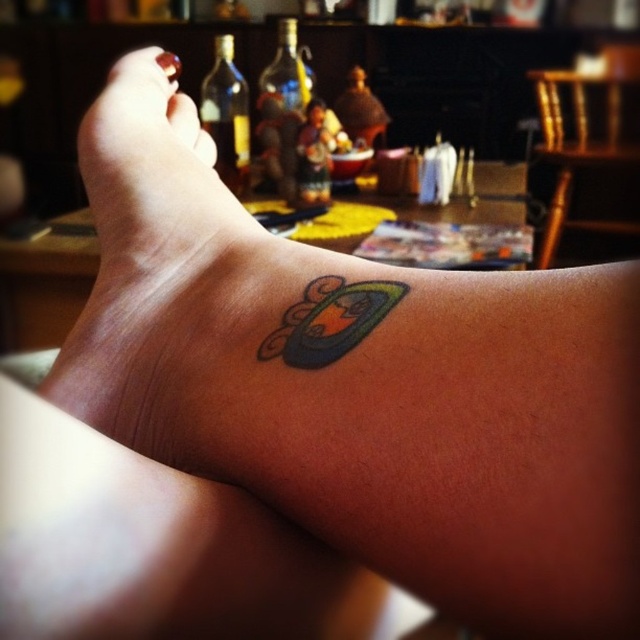
What are the coordinates of the multicolored glossy tattoo at lower center?

The multicolored glossy tattoo at lower center is located at point (330, 321).

You are holding a small flashlight that emits a beam 8 inches in diameter. You want to shine it directly on the point at coordinates point (342, 355) in the image. Considering the distance from your eye to the point, will the entire beam cover the point without spilling over to other areas?

The point at coordinates point (342, 355) is 7.55 inches away from the viewer. Since the flashlight beam is 8 inches in diameter, which is slightly larger than the distance, the beam will cover the point but may spill over slightly to adjacent areas.

Looking at this image, you are a photographer setting up a shoot in the scene. You need to position a small light source to the right of the matte skin toe at upper left. Will the transparent glass bottle at center block the light from reaching the toe?

The transparent glass bottle at center is to the left of the matte skin toe at upper left, so placing the light to the right of the toe would mean the bottle is not in the light path. The light should reach the toe without obstruction.